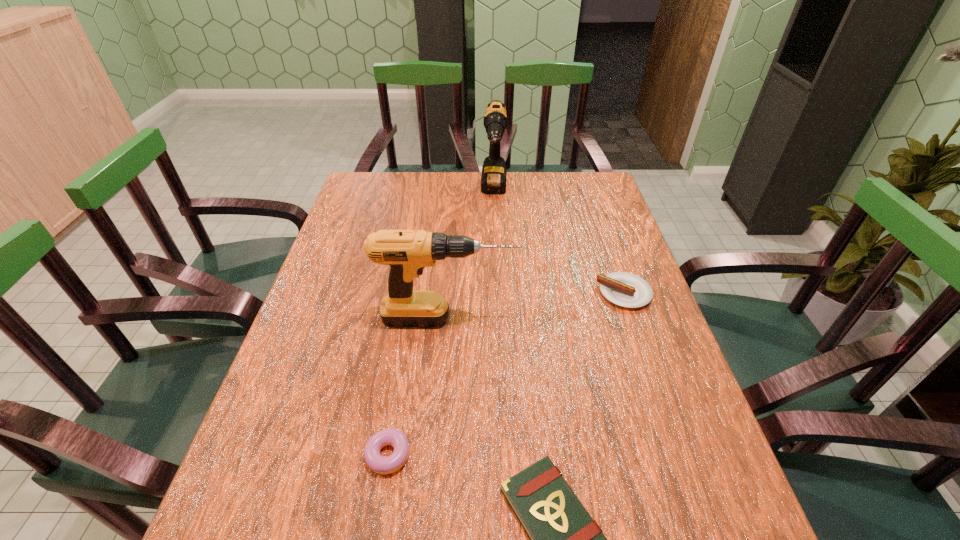
At what (x,y) coordinates should I click in order to perform the action: click on the farthest object. Please return your answer as a coordinate pair (x, y). Looking at the image, I should click on (493, 179).

Identify the location of the nearer drill. This screenshot has width=960, height=540. (407, 252).

This screenshot has width=960, height=540. I want to click on sausage, so click(x=624, y=289).

You are a GUI agent. You are given a task and a screenshot of the screen. Output one action in this format:
    pyautogui.click(x=<x>, y=<y>)
    Task: Click on the doughnut
    The image size is (960, 540).
    Given the screenshot: What is the action you would take?
    pyautogui.click(x=380, y=464)

What are the coordinates of `blank space located 0.170m at the tip of the farthest object` in the screenshot? It's located at (496, 241).

I want to click on vacant space located 0.080m at the tip of the nearer drill, so click(x=550, y=319).

You are a GUI agent. You are given a task and a screenshot of the screen. Output one action in this format:
    pyautogui.click(x=<x>, y=<y>)
    Task: Click on the free spot located 0.390m on the back of the sausage
    This screenshot has height=540, width=960.
    Given the screenshot: What is the action you would take?
    pyautogui.click(x=591, y=198)

At what (x,y) coordinates should I click in order to perform the action: click on vacant region located on the right of the doughnut. Please return your answer as a coordinate pair (x, y). The image size is (960, 540). Looking at the image, I should click on (464, 458).

In order to click on object positioned at the far edge in this screenshot , I will do `click(493, 179)`.

Identify the location of object present at the right edge. (624, 289).